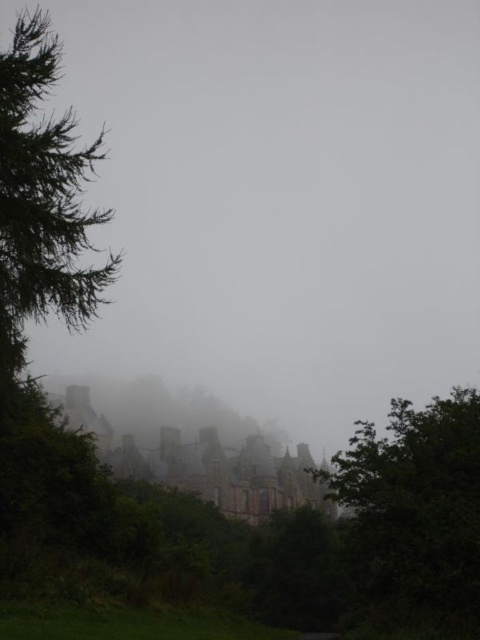
Question: Which of the following is the farthest from the observer?

Choices:
 (A) foggy translucent cloud at center
 (B) green needle-like leaves at left
 (C) green leafy tree at lower right

Answer: (A)

Question: Where is foggy translucent cloud at center located in relation to green leafy tree at lower right in the image?

Choices:
 (A) above
 (B) below

Answer: (A)

Question: Is foggy translucent cloud at center above green needle-like leaves at left?

Choices:
 (A) no
 (B) yes

Answer: (B)

Question: Which object is the farthest from the foggy translucent cloud at center?

Choices:
 (A) green leafy tree at lower right
 (B) green needle-like leaves at left

Answer: (A)

Question: Among these points, which one is farthest from the camera?

Choices:
 (A) coord(28,131)
 (B) coord(393,344)
 (C) coord(391,522)

Answer: (B)

Question: Does foggy translucent cloud at center appear over green needle-like leaves at left?

Choices:
 (A) yes
 (B) no

Answer: (A)